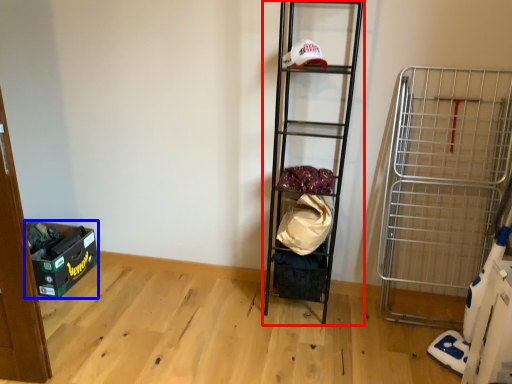
Question: Which object appears closest to the camera in this image, shelf (highlighted by a red box) or storage box (highlighted by a blue box)?

Choices:
 (A) shelf
 (B) storage box

Answer: (A)